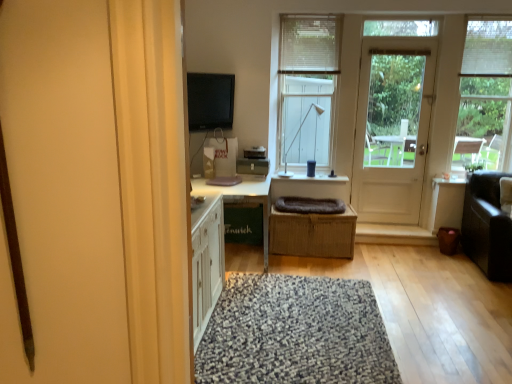
Question: Is the position of matte black flat screen tv at upper center less distant than that of speckled woolen rug at center?

Choices:
 (A) no
 (B) yes

Answer: (A)

Question: Can we say matte black flat screen tv at upper center lies outside speckled woolen rug at center?

Choices:
 (A) no
 (B) yes

Answer: (B)

Question: Is matte black flat screen tv at upper center with speckled woolen rug at center?

Choices:
 (A) yes
 (B) no

Answer: (B)

Question: Does matte black flat screen tv at upper center have a larger size compared to speckled woolen rug at center?

Choices:
 (A) yes
 (B) no

Answer: (B)

Question: Is matte black flat screen tv at upper center wider than speckled woolen rug at center?

Choices:
 (A) no
 (B) yes

Answer: (A)

Question: In the image, is transparent glass window at upper right, arranged as the first window when viewed from the right, positioned in front of or behind matte black flat screen tv at upper center?

Choices:
 (A) behind
 (B) front

Answer: (A)

Question: Considering the positions of transparent glass window at upper right, acting as the 2th window starting from the left, and matte black flat screen tv at upper center in the image, is transparent glass window at upper right, acting as the 2th window starting from the left, wider or thinner than matte black flat screen tv at upper center?

Choices:
 (A) wide
 (B) thin

Answer: (A)

Question: Is transparent glass window at upper right, acting as the 2th window starting from the left, spatially inside matte black flat screen tv at upper center, or outside of it?

Choices:
 (A) inside
 (B) outside

Answer: (B)

Question: From a real-world perspective, is transparent glass window at upper right, arranged as the first window when viewed from the right, above or below matte black flat screen tv at upper center?

Choices:
 (A) below
 (B) above

Answer: (B)

Question: From a real-world perspective, is dark gray plush blanket at center above or below woven brown basket at center?

Choices:
 (A) above
 (B) below

Answer: (A)

Question: Considering the positions of dark gray plush blanket at center and woven brown basket at center in the image, is dark gray plush blanket at center wider or thinner than woven brown basket at center?

Choices:
 (A) thin
 (B) wide

Answer: (A)

Question: From the image's perspective, is dark gray plush blanket at center above or below woven brown basket at center?

Choices:
 (A) above
 (B) below

Answer: (A)

Question: Is point click(304, 205) positioned closer to the camera than point click(345, 226)?

Choices:
 (A) closer
 (B) farther

Answer: (B)

Question: From the image's perspective, relative to dark brown leather couch at right, is dark gray plush blanket at center above or below?

Choices:
 (A) below
 (B) above

Answer: (B)

Question: From a real-world perspective, is dark gray plush blanket at center above or below dark brown leather couch at right?

Choices:
 (A) above
 (B) below

Answer: (A)